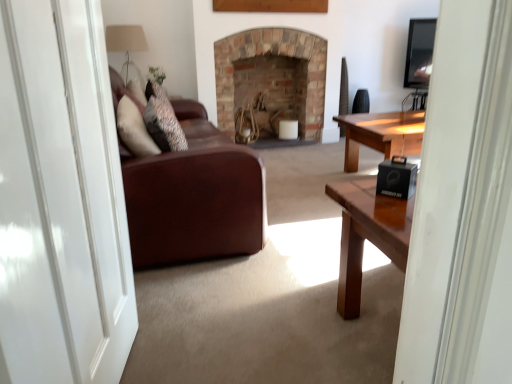
Locate an element on the screen. This screenshot has width=512, height=384. blank space to the left of black matte speaker at lower right is located at coordinates (357, 197).